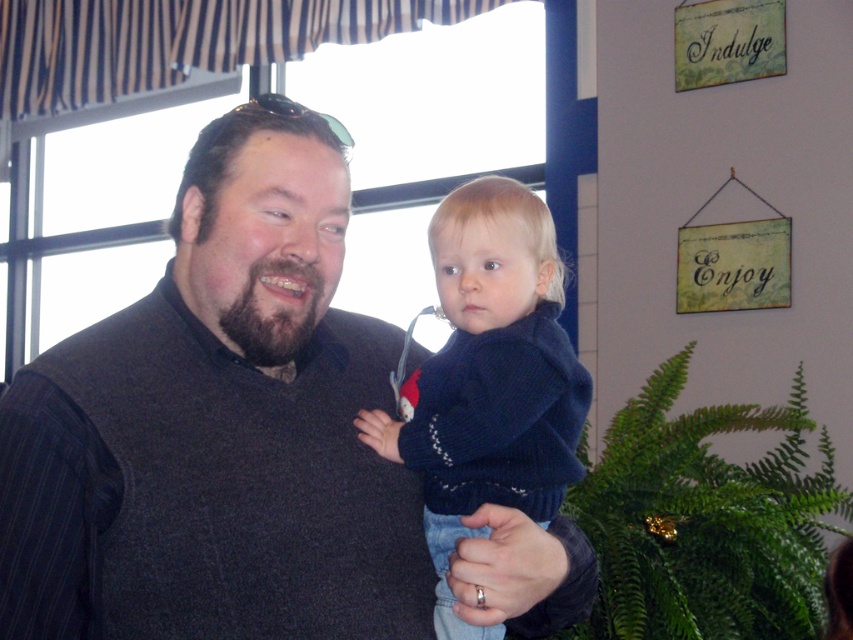
You are a tailor measuring sweaters for a customer. You see the dark gray sweater at center and the dark blue sweater at center. Which one has a larger size?

The dark gray sweater at center has a larger size compared to the dark blue sweater at center.

You are a photographer setting up for a family photo shoot. You notice two sweaters, the dark gray sweater at center and the dark blue sweater at center, hanging on the wall. Which sweater should you adjust to ensure it is more prominent in the photo?

The dark gray sweater at center is closer to the viewer than the dark blue sweater at center, so adjusting the dark blue sweater to bring it forward would make it more prominent in the photo.